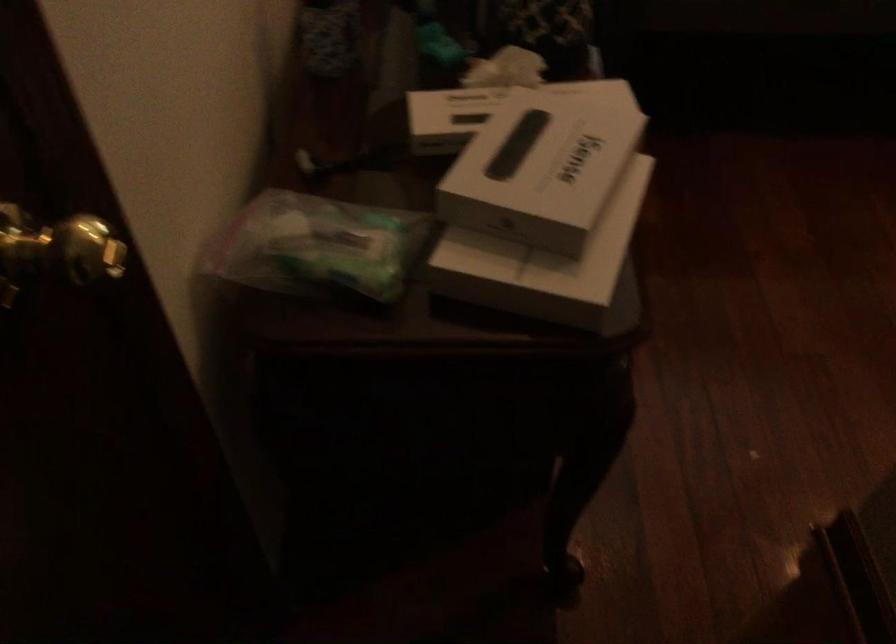
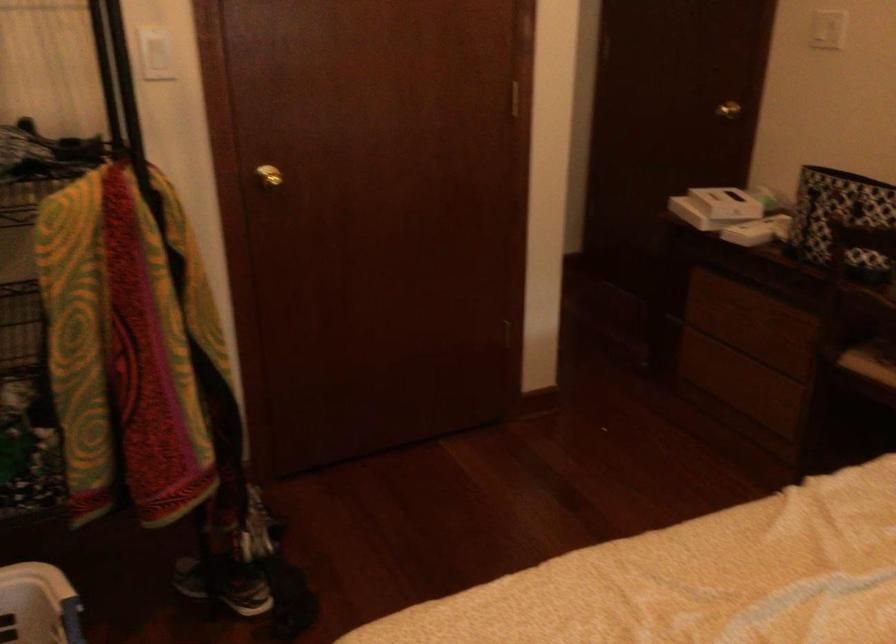
Where in the second image is the point corresponding to the point at 142,122 from the first image?

(734, 106)